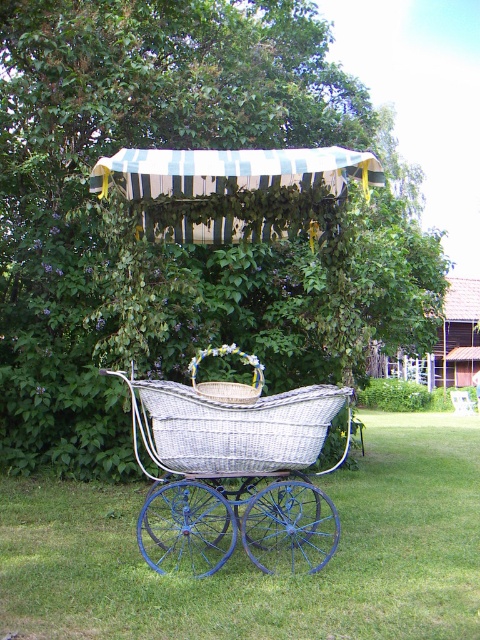
You are a parent trying to place a small stuffed animal in the white wicker carriage at center and the woven wicker baby carriage at center. Which carriage should you place it in if you want it closer to the left side of the image?

You should place the stuffed animal in the woven wicker baby carriage at center because the white wicker carriage at center is to the right of it, making the woven wicker baby carriage at center closer to the left side of the image.

You are standing in front of the vintage baby carriage and want to place a small toy. You need to know which point is closer to you to place it there. Which point is closer to you between point (303, 365) and point (152, 227)?

Point (152, 227) is closer to you than point (303, 365) because the description states that point (303, 365) is further to the camera than point (152, 227).